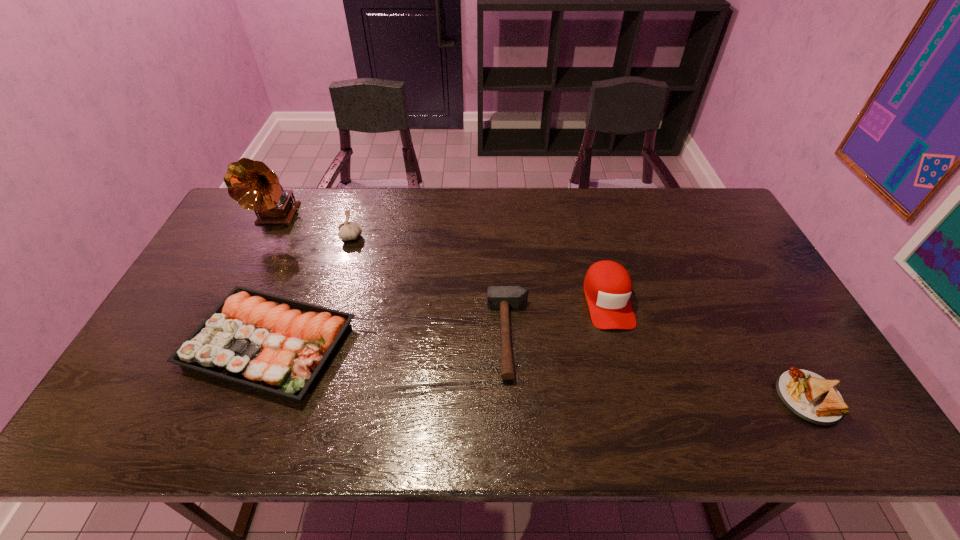
Locate an element on the screen. platter situated at the left edge is located at coordinates (278, 345).

Where is `object positioned at the right edge`? This screenshot has height=540, width=960. object positioned at the right edge is located at coordinates (809, 396).

At what (x,y) coordinates should I click in order to perform the action: click on object at the far left corner. Please return your answer as a coordinate pair (x, y). This screenshot has height=540, width=960. Looking at the image, I should click on (252, 184).

I want to click on object present at the near left corner, so click(x=278, y=345).

I want to click on object located at the near right corner, so click(x=809, y=396).

I want to click on free space at the far edge, so click(x=296, y=200).

Where is `vacant area at the near edge of the desktop`? This screenshot has width=960, height=540. vacant area at the near edge of the desktop is located at coordinates (373, 420).

In the image, there is a desktop. In order to click on vacant space at the left edge in this screenshot , I will do `click(180, 390)`.

The width and height of the screenshot is (960, 540). Find the location of `vacant space at the right edge of the desktop`. vacant space at the right edge of the desktop is located at coordinates (764, 343).

Find the location of a particular element. vacant area at the near left corner is located at coordinates (139, 441).